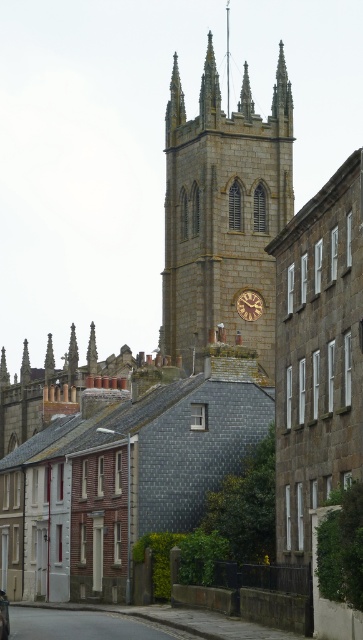
Question: Based on their relative distances, which object is nearer to the metallic silver car at center?

Choices:
 (A) brown stone clock at center
 (B) stone clock tower at center

Answer: (A)

Question: Based on their relative distances, which object is farther from the brown stone clock at center?

Choices:
 (A) metallic silver car at center
 (B) stone clock tower at center

Answer: (A)

Question: Which object is farther from the camera taking this photo?

Choices:
 (A) stone clock tower at center
 (B) brown stone clock at center

Answer: (B)

Question: Does stone clock tower at center have a smaller size compared to metallic silver car at center?

Choices:
 (A) yes
 (B) no

Answer: (B)

Question: Is stone clock tower at center thinner than metallic silver car at center?

Choices:
 (A) no
 (B) yes

Answer: (A)

Question: Is brown stone clock at center bigger than metallic silver car at center?

Choices:
 (A) yes
 (B) no

Answer: (B)